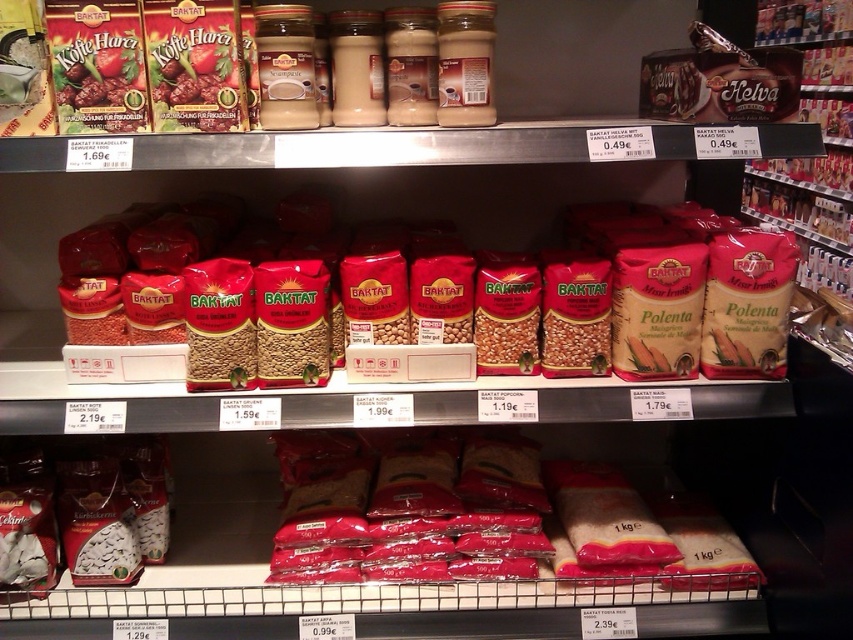
Between point (498, 269) and point (473, 529), which one is positioned behind?

Point (473, 529)

Can you confirm if red matte beans at center is positioned to the left of red matte rice at center?

A: Yes, red matte beans at center is to the left of red matte rice at center.

This screenshot has width=853, height=640. I want to click on red matte beans at center, so click(585, 298).